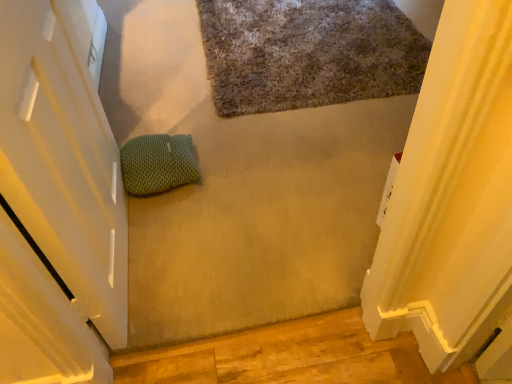
Locate an element on the screen. free space behind green mesh pillow at center is located at coordinates (174, 126).